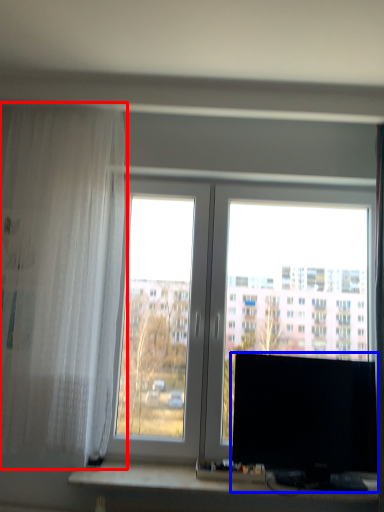
Question: Among these objects, which one is farthest to the camera, curtain (highlighted by a red box) or computer monitor (highlighted by a blue box)?

Choices:
 (A) curtain
 (B) computer monitor

Answer: (B)